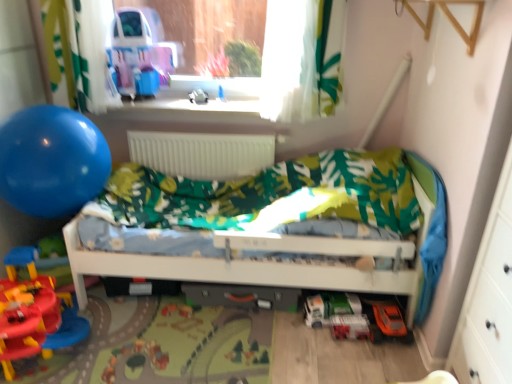
What do you see at coordinates (202, 153) in the screenshot? This screenshot has height=384, width=512. I see `white matte radiator at center` at bounding box center [202, 153].

What is the approximate height of translucent plastic toy car at lower right, arranged as the 2th toy when viewed from the right?

translucent plastic toy car at lower right, arranged as the 2th toy when viewed from the right, is 4.09 inches tall.

What is the approximate height of white matte infant bed at center?

The height of white matte infant bed at center is 27.85 inches.

What do you see at coordinates (391, 320) in the screenshot? The width and height of the screenshot is (512, 384). I see `orange matte toy car at lower right, which is the fourth toy from top to bottom` at bounding box center [391, 320].

This screenshot has width=512, height=384. What do you see at coordinates (141, 49) in the screenshot? I see `shiny plastic toy car at upper left` at bounding box center [141, 49].

What do you see at coordinates (32, 313) in the screenshot? The width and height of the screenshot is (512, 384). I see `rubberized plastic playset at lower left, acting as the 1th toy starting from the front` at bounding box center [32, 313].

Image resolution: width=512 pixels, height=384 pixels. Identify the location of rubberized plastic playset at lower left, marked as the first toy in a left-to-right arrangement. (32, 313).

Locate an element on the screen. The height and width of the screenshot is (384, 512). white matte radiator at center is located at coordinates (202, 153).

From the image's perspective, between clear plastic window sill at upper center and white matte radiator at center, who is located below?

white matte radiator at center.

Is clear plastic window sill at upper center taller or shorter than white matte radiator at center?

In the image, clear plastic window sill at upper center appears to be shorter than white matte radiator at center.

Can you confirm if clear plastic window sill at upper center is smaller than white matte radiator at center?

Yes, clear plastic window sill at upper center is smaller than white matte radiator at center.

Is point (127, 98) in front of point (253, 174)?

Yes, it is.

Between orange matte toy car at lower right, positioned as the 1th toy in right-to-left order, and green matte toy car at lower center, which is the third toy in right-to-left order, which one has smaller size?

With smaller size is green matte toy car at lower center, which is the third toy in right-to-left order.

Based on the photo, is orange matte toy car at lower right, which is the 5th toy from left to right, located outside green matte toy car at lower center, which is counted as the 2th toy, starting from the back?

Yes, orange matte toy car at lower right, which is the 5th toy from left to right, is located beyond the bounds of green matte toy car at lower center, which is counted as the 2th toy, starting from the back.

Is orange matte toy car at lower right, which is the fourth toy from top to bottom, facing away from green matte toy car at lower center, which is counted as the 2th toy, starting from the back?

orange matte toy car at lower right, which is the fourth toy from top to bottom, does not have its back to green matte toy car at lower center, which is counted as the 2th toy, starting from the back.

Does white plastic toy at center, which is the fifth toy in front-to-back order, come in front of white matte radiator at center?

That is False.

Image resolution: width=512 pixels, height=384 pixels. I want to click on toy above the white matte radiator at center (from a real-world perspective), so click(198, 96).

Can you confirm if white plastic toy at center, the 1th toy positioned from the top, is taller than white matte radiator at center?

In fact, white plastic toy at center, the 1th toy positioned from the top, may be shorter than white matte radiator at center.

From a real-world perspective, which is physically above, white plastic toy at center, which is counted as the 4th toy, starting from the right, or white matte radiator at center?

white plastic toy at center, which is counted as the 4th toy, starting from the right.

Between clear plastic window sill at upper center and blue rubber balloon at left, which one appears on the right side from the viewer's perspective?

From the viewer's perspective, clear plastic window sill at upper center appears more on the right side.

Is clear plastic window sill at upper center positioned far away from blue rubber balloon at left?

They are positioned close to each other.

Is clear plastic window sill at upper center positioned beyond the bounds of blue rubber balloon at left?

Yes, clear plastic window sill at upper center is outside of blue rubber balloon at left.

From the image's perspective, is white matte infant bed at center located above or below rubberized plastic playset at lower left, positioned as the fifth toy in back-to-front order?

white matte infant bed at center is above rubberized plastic playset at lower left, positioned as the fifth toy in back-to-front order.

Considering the positions of objects white matte infant bed at center and rubberized plastic playset at lower left, the second toy when ordered from top to bottom, in the image provided, who is behind, white matte infant bed at center or rubberized plastic playset at lower left, the second toy when ordered from top to bottom,?

white matte infant bed at center.

Looking at their sizes, would you say white matte infant bed at center is wider or thinner than rubberized plastic playset at lower left, which is the 5th toy from right to left?

Considering their sizes, white matte infant bed at center looks broader than rubberized plastic playset at lower left, which is the 5th toy from right to left.

Considering the relative positions of blue rubber balloon at left and white matte infant bed at center in the image provided, is blue rubber balloon at left to the left or to the right of white matte infant bed at center?

Based on their positions, blue rubber balloon at left is located to the left of white matte infant bed at center.

Is blue rubber balloon at left in front of or behind white matte infant bed at center in the image?

Clearly, blue rubber balloon at left is behind white matte infant bed at center.

From the image's perspective, is blue rubber balloon at left above or below white matte infant bed at center?

Based on their image positions, blue rubber balloon at left is located above white matte infant bed at center.

From the picture: Is blue rubber balloon at left inside the boundaries of white matte infant bed at center, or outside?

blue rubber balloon at left is not inside white matte infant bed at center, it's outside.

Can you see shiny plastic toy car at upper left touching orange matte toy car at lower right, placed as the second toy when sorted from front to back?

shiny plastic toy car at upper left and orange matte toy car at lower right, placed as the second toy when sorted from front to back, are not in contact.

Would you say shiny plastic toy car at upper left is inside or outside orange matte toy car at lower right, which is the fourth toy from top to bottom?

shiny plastic toy car at upper left is located beyond the bounds of orange matte toy car at lower right, which is the fourth toy from top to bottom.

Considering the points (169, 70) and (373, 309), which point is behind, point (169, 70) or point (373, 309)?

The point (169, 70) is farther from the camera.

From the picture: Who is more distant, shiny plastic toy car at upper left or orange matte toy car at lower right, which is the fourth toy from top to bottom?

shiny plastic toy car at upper left is behind.

Locate an element on the screen. This screenshot has width=512, height=384. window sill located above the white matte radiator at center (from a real-world perspective) is located at coordinates tap(187, 105).

From the image's perspective, starting from the green matte toy car at lower center, marked as the 3th toy in a top-to-bottom arrangement, which toy is the 1st one below? Please provide its 2D coordinates.

[(391, 320)]

From the picture: Estimate the real-world distances between objects in this image. Which object is further from white matte radiator at center, shiny plastic toy car at upper left or translucent plastic toy car at lower right, which ranks as the 1th toy in bottom-to-top order?

translucent plastic toy car at lower right, which ranks as the 1th toy in bottom-to-top order, is further to white matte radiator at center.

Looking at the image, which one is located further to orange matte toy car at lower right, the 4th toy viewed from the back, clear plastic window sill at upper center or shiny plastic toy car at upper left?

shiny plastic toy car at upper left lies further to orange matte toy car at lower right, the 4th toy viewed from the back, than the other object.

Considering their positions, is blue rubber balloon at left positioned further to white matte radiator at center than white matte infant bed at center?

Among the two, blue rubber balloon at left is located further to white matte radiator at center.

When comparing their distances from green matte toy car at lower center, the 3th toy ordered from the bottom, does orange matte toy car at lower right, which is the second toy from bottom to top, or translucent plastic toy car at lower right, the third toy in the front-to-back sequence, seem closer?

translucent plastic toy car at lower right, the third toy in the front-to-back sequence, is closer to green matte toy car at lower center, the 3th toy ordered from the bottom.

Based on their spatial positions, is white matte infant bed at center or shiny plastic toy car at upper left closer to orange matte toy car at lower right, which is the second toy from bottom to top?

white matte infant bed at center lies closer to orange matte toy car at lower right, which is the second toy from bottom to top, than the other object.

Based on their spatial positions, is translucent plastic toy car at lower right, the 4th toy positioned from the left, or white plastic toy at center, arranged as the second toy when viewed from the left, further from shiny plastic toy car at upper left?

translucent plastic toy car at lower right, the 4th toy positioned from the left, is positioned further to the anchor shiny plastic toy car at upper left.

Considering their positions, is translucent plastic toy car at lower right, positioned as the fifth toy in top-to-bottom order, positioned further to blue rubber balloon at left than clear plastic window sill at upper center?

Based on the image, translucent plastic toy car at lower right, positioned as the fifth toy in top-to-bottom order, appears to be further to blue rubber balloon at left.

Estimate the real-world distances between objects in this image. Which object is further from orange matte toy car at lower right, placed as the second toy when sorted from front to back, white plastic toy at center, arranged as the second toy when viewed from the left, or rubberized plastic playset at lower left, marked as the first toy in a left-to-right arrangement?

Among the two, white plastic toy at center, arranged as the second toy when viewed from the left, is located further to orange matte toy car at lower right, placed as the second toy when sorted from front to back.

Locate an element on the screen. Image resolution: width=512 pixels, height=384 pixels. radiator located between blue rubber balloon at left and white matte infant bed at center in the left-right direction is located at coordinates (202, 153).

The image size is (512, 384). In order to click on radiator located between blue rubber balloon at left and green matte toy car at lower center, the 4th toy in the front-to-back sequence, in the left-right direction in this screenshot , I will do `click(202, 153)`.

I want to click on infant bed located between blue rubber balloon at left and green matte toy car at lower center, which is the third toy in right-to-left order, in the left-right direction, so click(x=279, y=253).

Locate an element on the screen. balloon between shiny plastic toy car at upper left and rubberized plastic playset at lower left, which appears as the fourth toy when ordered from the bottom, in the vertical direction is located at coordinates (51, 161).